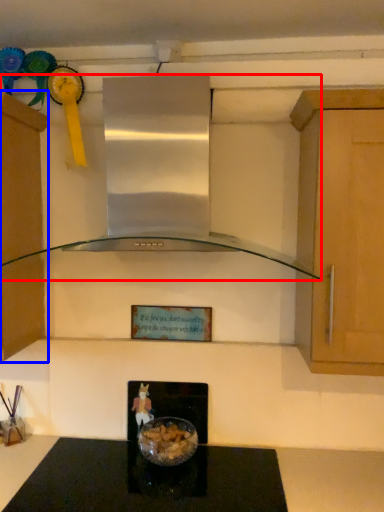
Question: Which of the following is the farthest to the observer, home appliance (highlighted by a red box) or cabinetry (highlighted by a blue box)?

Choices:
 (A) home appliance
 (B) cabinetry

Answer: (B)